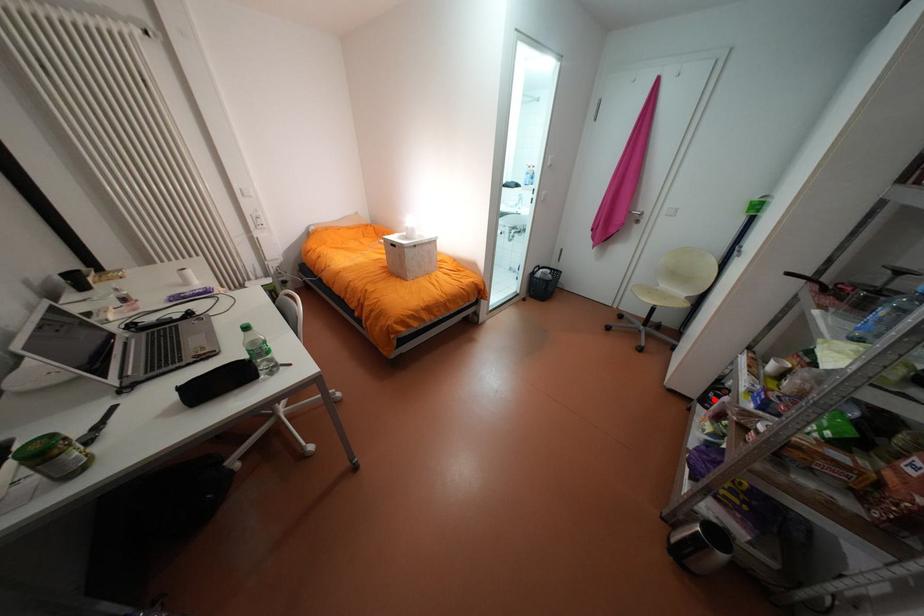
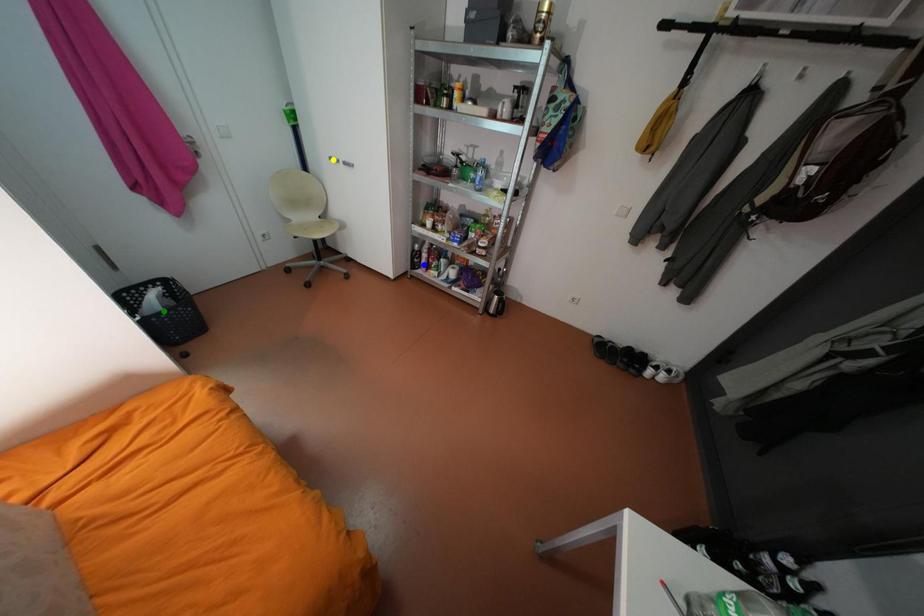
Question: I am providing you with two images of the same scene from different viewpoints. A red point is marked on the first image. You are given multiple points on the second image. Which point in image 2 represents the same 3d spot as the red point in image 1?

Choices:
 (A) yellow point
 (B) green point
 (C) blue point

Answer: (C)